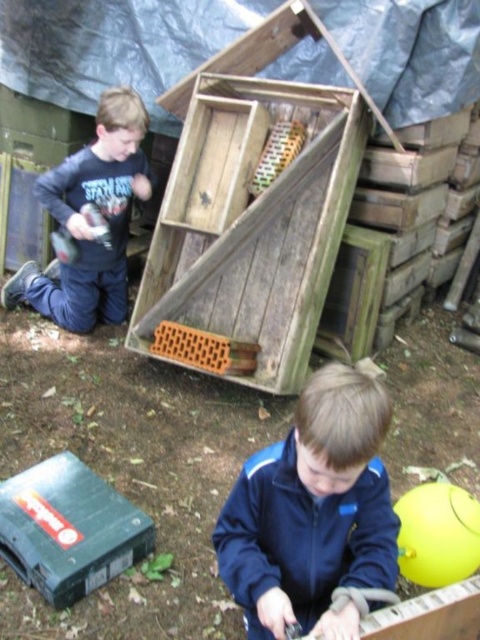
Question: Can you confirm if dark blue jacket at center is wider than dark blue fleece at left?

Choices:
 (A) yes
 (B) no

Answer: (B)

Question: Among these points, which one is farthest from the camera?

Choices:
 (A) (91, 300)
 (B) (374, 422)

Answer: (A)

Question: From the image, what is the correct spatial relationship of dark blue jacket at center in relation to dark blue fleece at left?

Choices:
 (A) left
 (B) right

Answer: (B)

Question: Among these points, which one is farthest from the camera?

Choices:
 (A) (259, 576)
 (B) (67, 164)

Answer: (B)

Question: Is dark blue jacket at center to the left of dark blue fleece at left from the viewer's perspective?

Choices:
 (A) no
 (B) yes

Answer: (A)